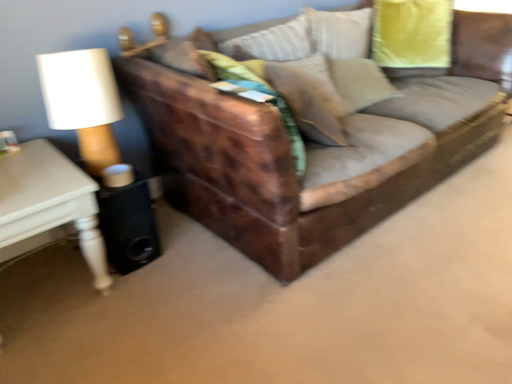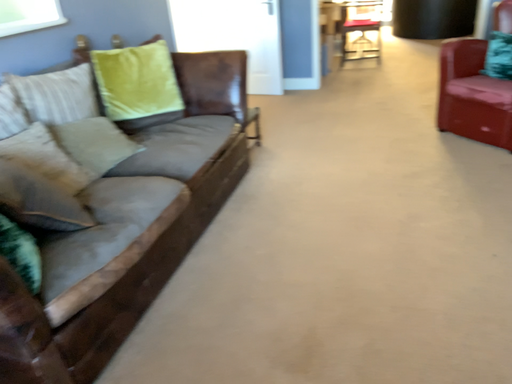
Question: How did the camera likely rotate when shooting the video?

Choices:
 (A) rotated downward
 (B) rotated upward

Answer: (B)